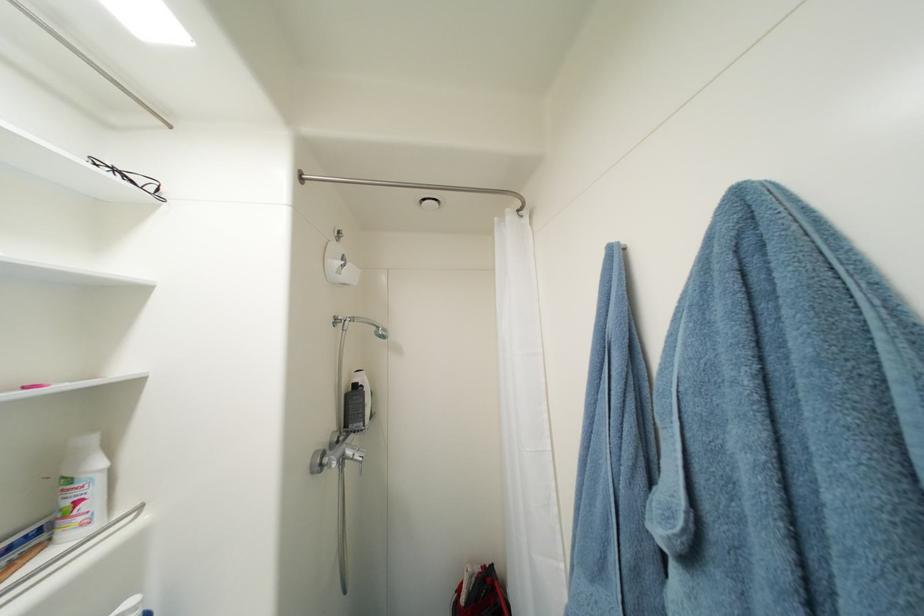
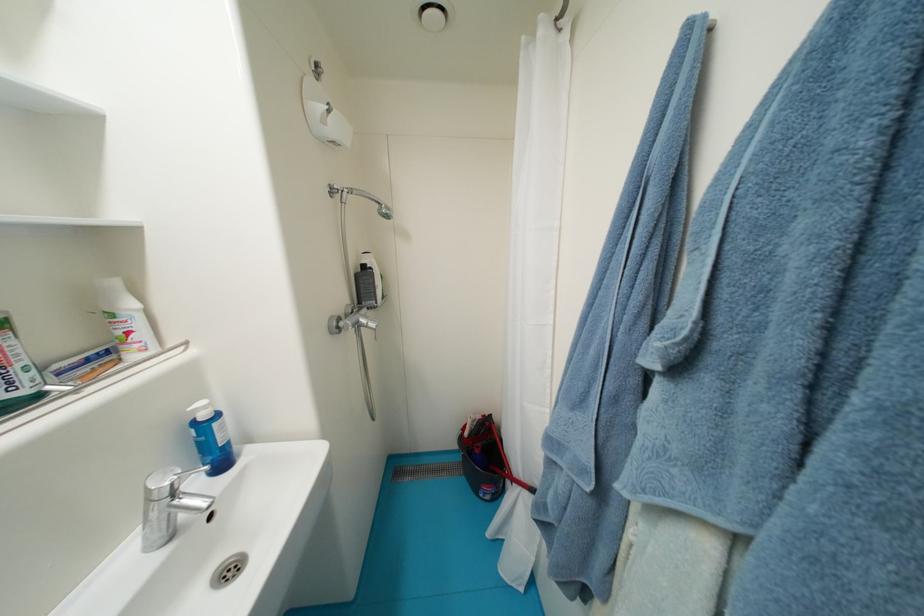
Question: How did the camera likely rotate?

Choices:
 (A) Left
 (B) Right
 (C) Up
 (D) Down

Answer: (D)